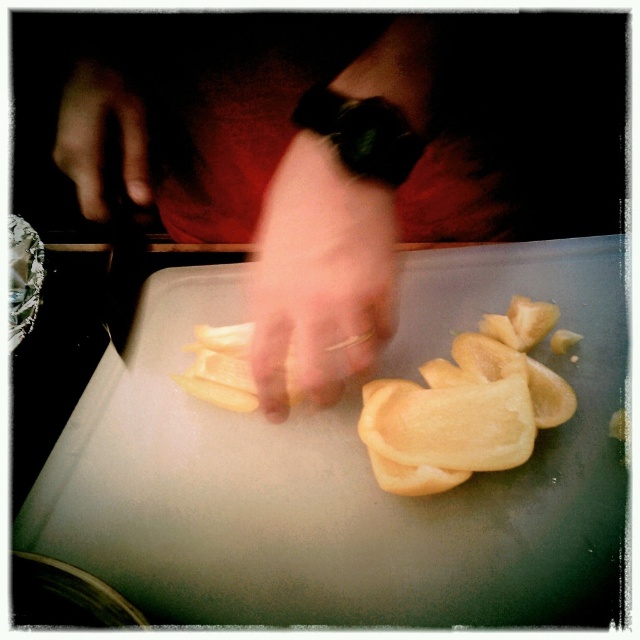
Question: Which object is positioned closest to the yellow matte onion at center?

Choices:
 (A) smooth skin hand at upper left
 (B) yellow matte apple slices at center

Answer: (A)

Question: Can you confirm if pale skin at center is thinner than yellow matte apple slices at center?

Choices:
 (A) no
 (B) yes

Answer: (B)

Question: Does yellow matte onion at center appear under pale skin at center?

Choices:
 (A) yes
 (B) no

Answer: (B)

Question: Which point appears closest to the camera in this image?

Choices:
 (A) (269, 408)
 (B) (499, 385)
 (C) (74, 129)
 (D) (380, 209)

Answer: (D)

Question: Which is farther from the smooth skin hand at upper left?

Choices:
 (A) yellow matte apple slices at center
 (B) yellow matte onion at center

Answer: (A)

Question: Considering the relative positions of pale skin at center and smooth skin hand at upper left in the image provided, where is pale skin at center located with respect to smooth skin hand at upper left?

Choices:
 (A) above
 (B) below

Answer: (B)